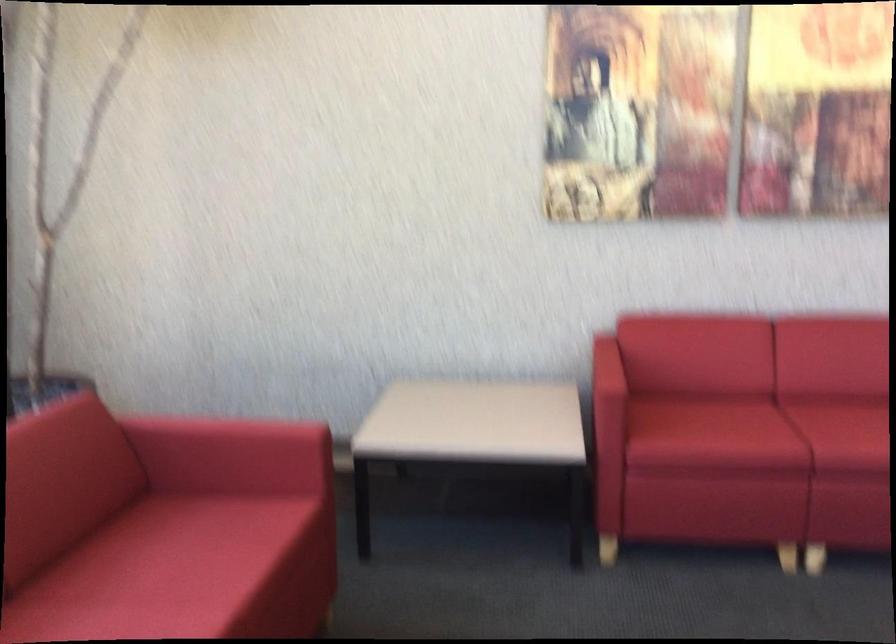
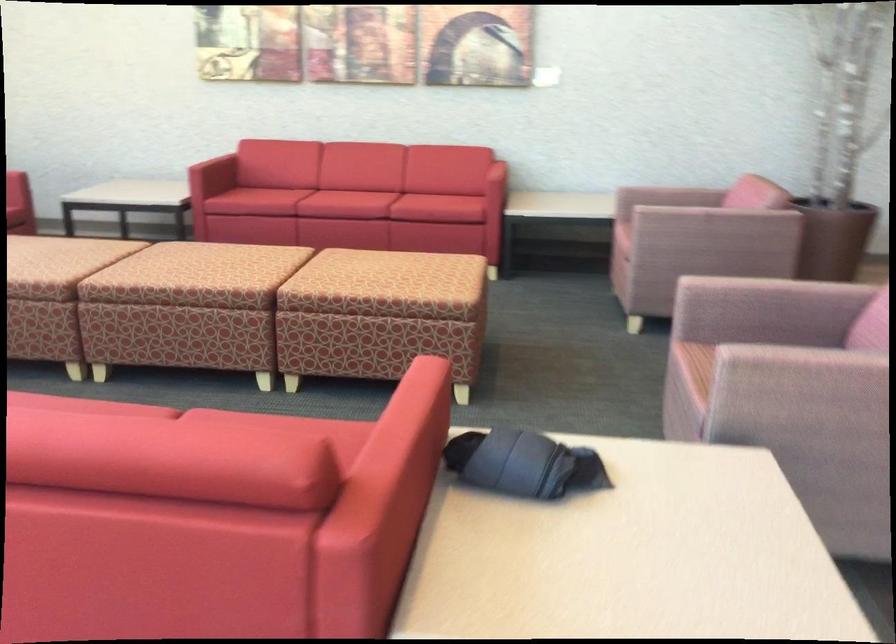
Find the pixel in the second image that matches point (762, 485) in the first image.

(265, 200)